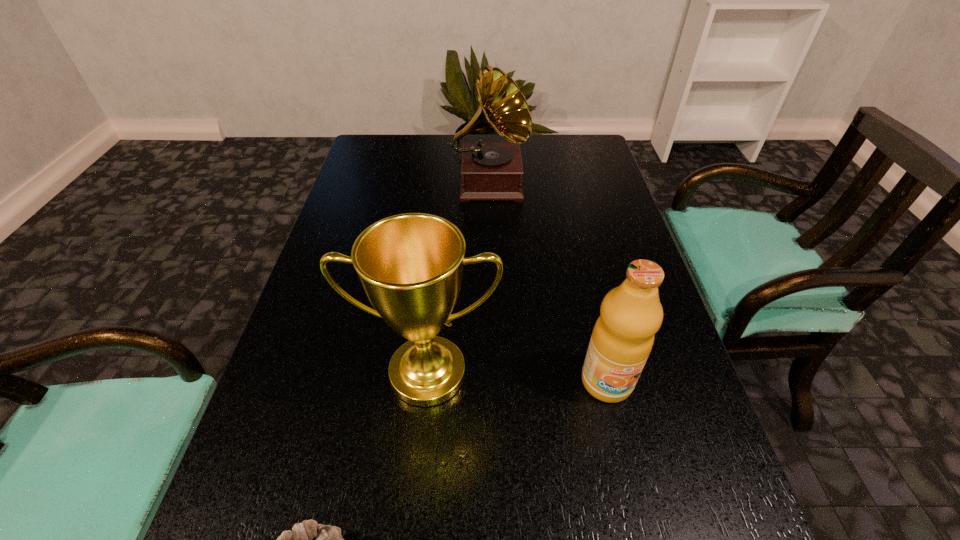
Where is `the farthest object`? the farthest object is located at coordinates (490, 170).

The image size is (960, 540). In order to click on award in this screenshot , I will do `click(410, 265)`.

Find the location of a particular element. the rightmost object is located at coordinates (631, 314).

The height and width of the screenshot is (540, 960). I want to click on free region located 0.090m from the horn of the phonograph record, so click(x=491, y=237).

This screenshot has height=540, width=960. Find the location of `vacant region located 0.050m by the handles of the award`. vacant region located 0.050m by the handles of the award is located at coordinates (420, 440).

This screenshot has height=540, width=960. I want to click on free space located 0.050m on the front label of the rightmost object, so click(x=618, y=431).

At what (x,y) coordinates should I click in order to perform the action: click on object situated at the far edge. Please return your answer as a coordinate pair (x, y). Image resolution: width=960 pixels, height=540 pixels. Looking at the image, I should click on (490, 170).

The width and height of the screenshot is (960, 540). In order to click on object that is positioned at the left edge in this screenshot , I will do `click(410, 265)`.

Locate an element on the screen. This screenshot has width=960, height=540. object located at the right edge is located at coordinates (631, 314).

At what (x,y) coordinates should I click in order to perform the action: click on vacant area at the left edge. Please return your answer as a coordinate pair (x, y). This screenshot has width=960, height=540. Looking at the image, I should click on (276, 497).